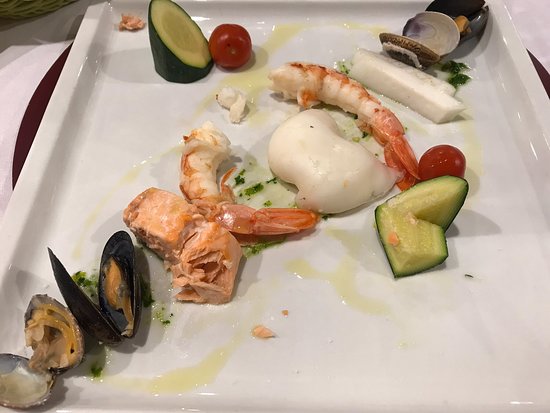
Image resolution: width=550 pixels, height=413 pixels. What are the coordinates of `edge of basket` in the screenshot? It's located at (33, 8).